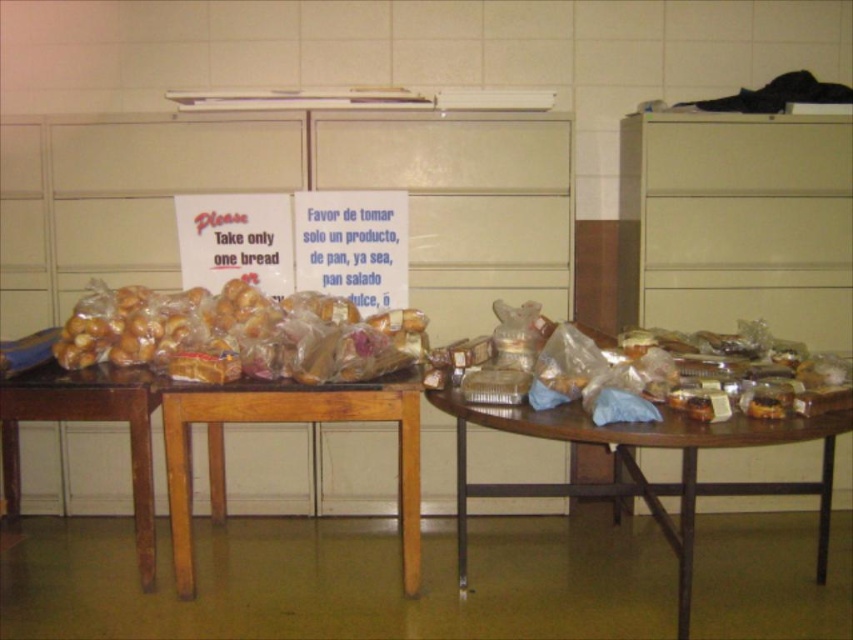
Question: Which object is the closest to the translucent plastic bag at center?

Choices:
 (A) wooden table at lower right
 (B) translucent plastic baguette at center

Answer: (A)

Question: Estimate the real-world distances between objects in this image. Which object is farther from the translucent plastic baguette at center?

Choices:
 (A) wooden table at lower right
 (B) wooden table at left

Answer: (A)

Question: Is the position of wooden table at left more distant than that of wooden table at lower right?

Choices:
 (A) no
 (B) yes

Answer: (B)

Question: Is translucent plastic bag at center below wooden table at lower right?

Choices:
 (A) yes
 (B) no

Answer: (B)

Question: Which point is closer to the camera?

Choices:
 (A) (48, 406)
 (B) (747, 429)
 (C) (544, 403)

Answer: (B)

Question: Does wooden table at left have a larger size compared to translucent plastic baguette at center?

Choices:
 (A) yes
 (B) no

Answer: (A)